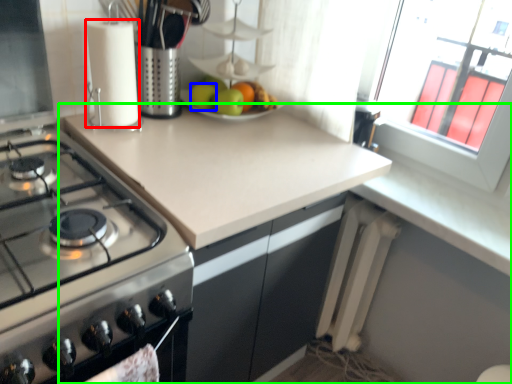
Question: Considering the real-world distances, which object is closest to kitchen appliance (highlighted by a red box)? apple (highlighted by a blue box) or countertop (highlighted by a green box).

Choices:
 (A) apple
 (B) countertop

Answer: (A)